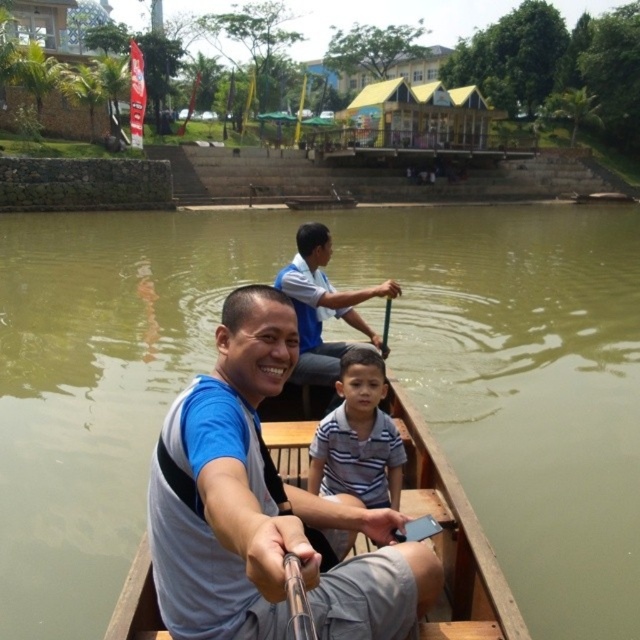
Question: Based on their relative distances, which object is nearer to the greenish-brown wood boat at center?

Choices:
 (A) striped cotton shirt at center
 (B) blue fabric shirt at center
 (C) gray fabric shirt at center

Answer: (A)

Question: Is greenish-brown wood boat at center further to the viewer compared to striped cotton shirt at center?

Choices:
 (A) no
 (B) yes

Answer: (B)

Question: Does gray fabric shirt at center have a greater width compared to blue fabric shirt at center?

Choices:
 (A) no
 (B) yes

Answer: (B)

Question: Which object appears farthest from the camera in this image?

Choices:
 (A) blue fabric shirt at center
 (B) greenish-brown wood boat at center
 (C) striped cotton shirt at center
 (D) gray fabric shirt at center

Answer: (A)

Question: Estimate the real-world distances between objects in this image. Which object is closer to the gray fabric shirt at center?

Choices:
 (A) blue fabric shirt at center
 (B) striped cotton shirt at center

Answer: (B)

Question: Observing the image, what is the correct spatial positioning of gray fabric shirt at center in reference to striped cotton shirt at center?

Choices:
 (A) below
 (B) above

Answer: (A)